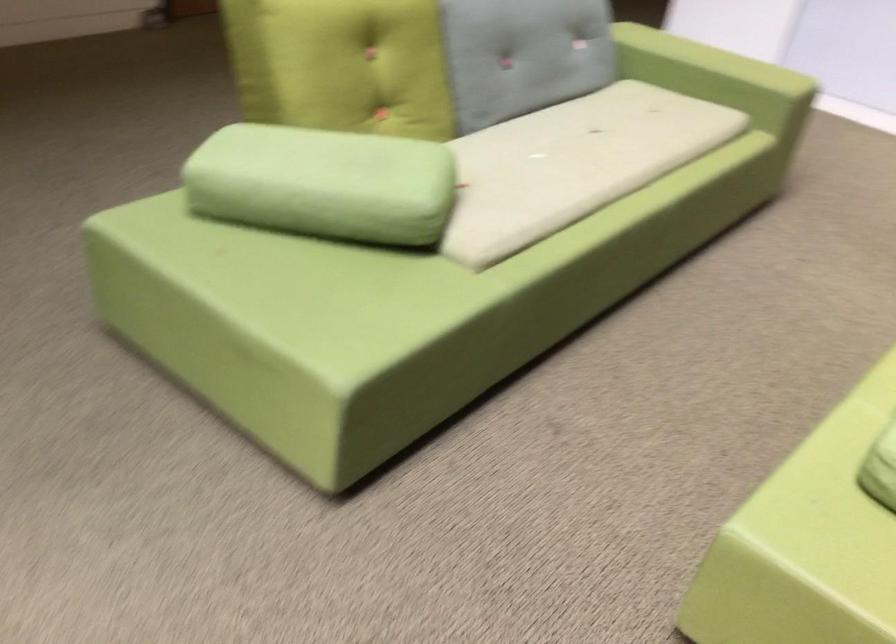
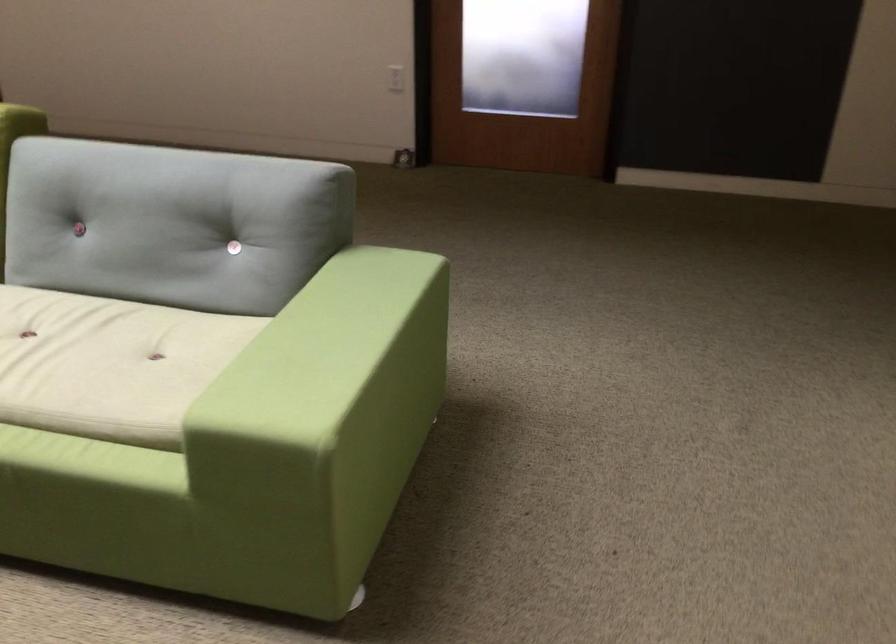
The point at (661, 113) is marked in the first image. Where is the corresponding point in the second image?

(109, 364)